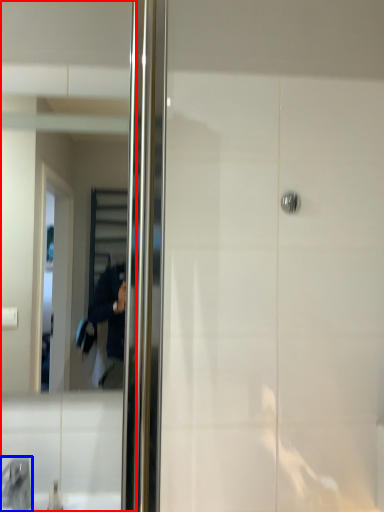
Question: Which object is further to the camera taking this photo, mirror (highlighted by a red box) or faucet (highlighted by a blue box)?

Choices:
 (A) mirror
 (B) faucet

Answer: (A)